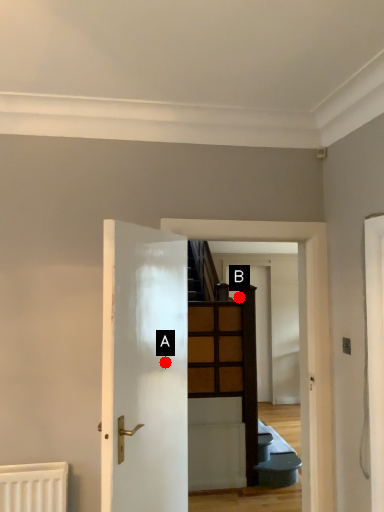
Question: Two points are circled on the image, labeled by A and B beside each circle. Among these points, which one is farthest from the camera?

Choices:
 (A) A is further
 (B) B is further

Answer: (B)